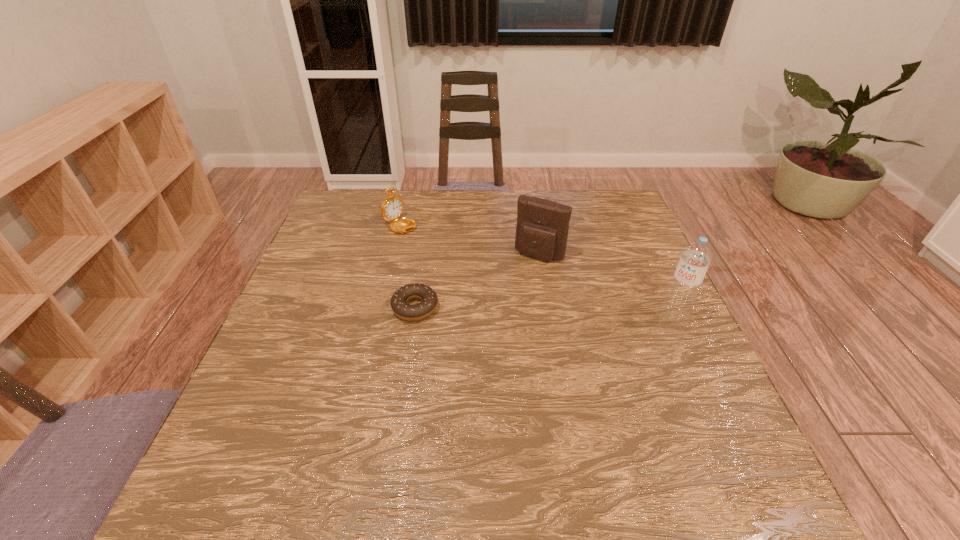
At what (x,y) coordinates should I click in order to perform the action: click on blank space located 0.260m with an open flap on the third nearest object. Please return your answer as a coordinate pair (x, y). Looking at the image, I should click on (492, 329).

Find the location of a particular element. This screenshot has height=540, width=960. free space located with an open flap on the third nearest object is located at coordinates (468, 370).

Locate an element on the screen. blank area located on the face of the second shortest object is located at coordinates (455, 249).

This screenshot has height=540, width=960. Identify the location of free space located on the face of the second shortest object. (463, 254).

Identify the location of vacant space located 0.160m on the face of the second shortest object. point(460,253).

You are a GUI agent. You are given a task and a screenshot of the screen. Output one action in this format:
    pyautogui.click(x=<x>, y=<y>)
    Task: Click on the object that is at the far edge
    
    Given the screenshot: What is the action you would take?
    pyautogui.click(x=392, y=207)

Where is `object located at the right edge`? The width and height of the screenshot is (960, 540). object located at the right edge is located at coordinates (696, 257).

The height and width of the screenshot is (540, 960). Find the location of `vacant region at the far edge`. vacant region at the far edge is located at coordinates (401, 196).

Image resolution: width=960 pixels, height=540 pixels. Find the location of `free space at the near edge of the desktop`. free space at the near edge of the desktop is located at coordinates (408, 442).

Where is `vacant space at the left edge of the desktop`? This screenshot has width=960, height=540. vacant space at the left edge of the desktop is located at coordinates (337, 255).